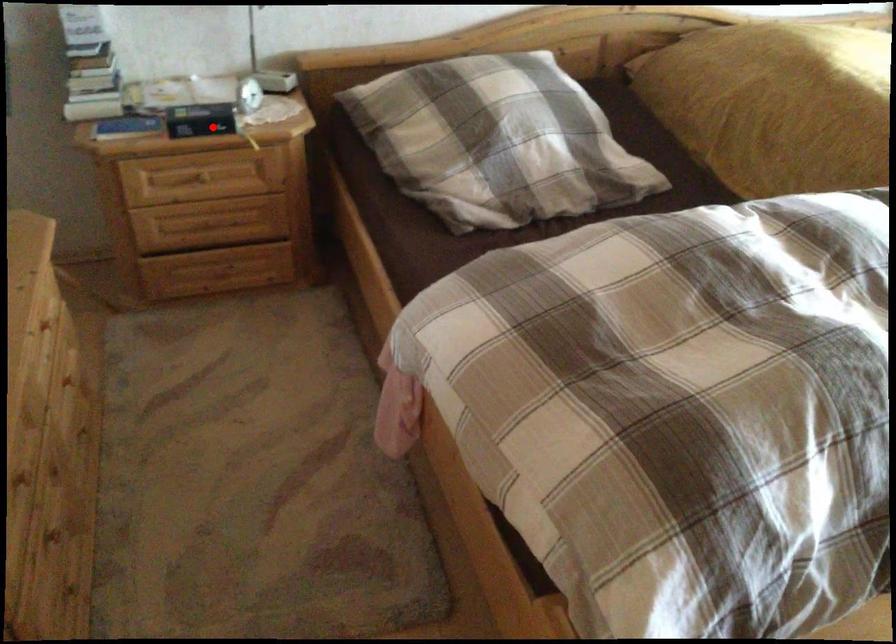
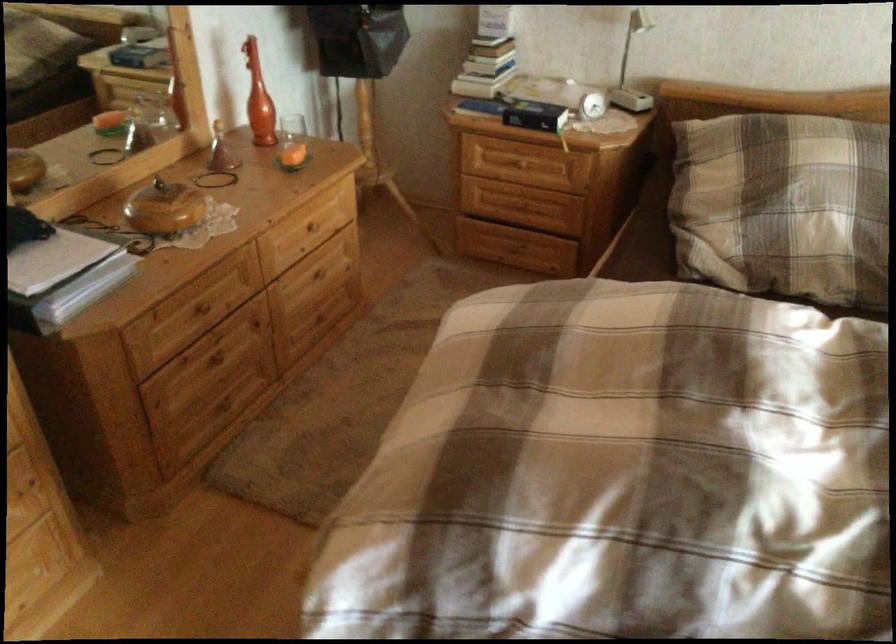
The point at the highlighted location is marked in the first image. Where is the corresponding point in the second image?

(535, 115)